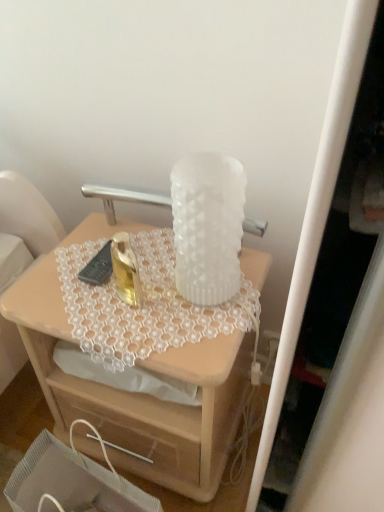
Question: Is white frosted vase at center taller or shorter than translucent glass vase at upper center?

Choices:
 (A) tall
 (B) short

Answer: (B)

Question: Is white frosted vase at center inside or outside of translucent glass vase at upper center?

Choices:
 (A) outside
 (B) inside

Answer: (A)

Question: Which object is positioned farthest from the white frosted vase at center?

Choices:
 (A) wooden drawer at lower center
 (B) translucent glass vase at upper center

Answer: (A)

Question: Which object is the farthest from the white frosted vase at center?

Choices:
 (A) wooden drawer at lower center
 (B) translucent glass vase at upper center

Answer: (A)